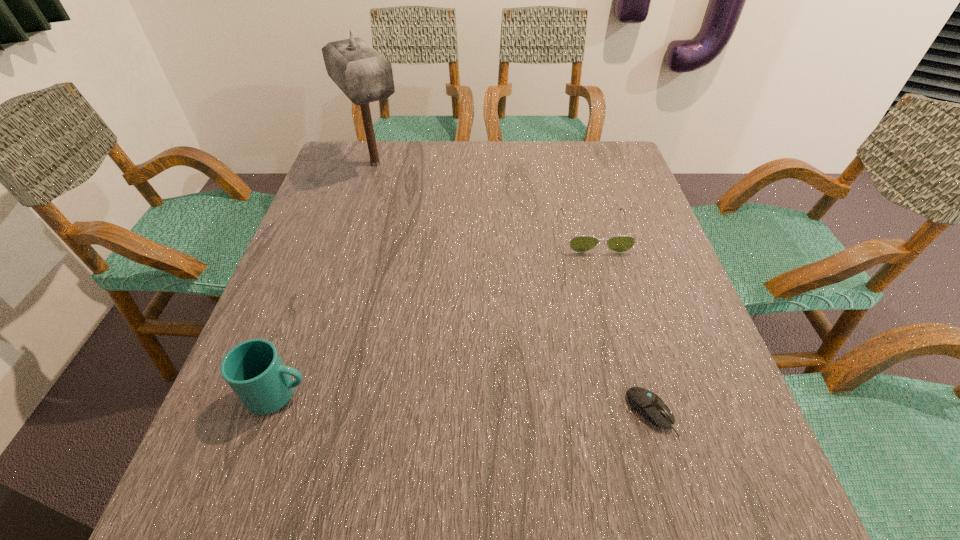
At what (x,y) coordinates should I click in order to perform the action: click on empty space that is in between the second farthest object and the shortest object. Please return your answer as a coordinate pair (x, y). The image size is (960, 540). Looking at the image, I should click on [x=622, y=322].

You are a GUI agent. You are given a task and a screenshot of the screen. Output one action in this format:
    pyautogui.click(x=<x>, y=<y>)
    Task: Click on the vacant space that's between the second tallest object and the second farthest object
    The height and width of the screenshot is (540, 960).
    Given the screenshot: What is the action you would take?
    pyautogui.click(x=436, y=313)

Locate which object ranks third in proximity to the computer mouse. Please provide its 2D coordinates. Your answer should be formatted as a tuple, i.e. [(x, y)], where the tuple contains the x and y coordinates of a point satisfying the conditions above.

[(363, 75)]

Image resolution: width=960 pixels, height=540 pixels. In order to click on object that is the third closest to the second shortest object in this screenshot , I will do `click(254, 370)`.

The image size is (960, 540). I want to click on vacant point that satisfies the following two spatial constraints: 1. on the front-facing side of the second shortest object; 2. on the handle side of the cup, so click(638, 394).

The image size is (960, 540). Identify the location of free space that satisfies the following two spatial constraints: 1. on the front-facing side of the second shortest object; 2. on the right side of the computer mouse. (644, 413).

Find the location of a particular element. vacant space that satisfies the following two spatial constraints: 1. on the handle side of the cup; 2. on the left side of the shortest object is located at coordinates (272, 413).

Find the location of a particular element. free space that satisfies the following two spatial constraints: 1. on the front-facing side of the second shortest object; 2. on the handle side of the cup is located at coordinates (638, 394).